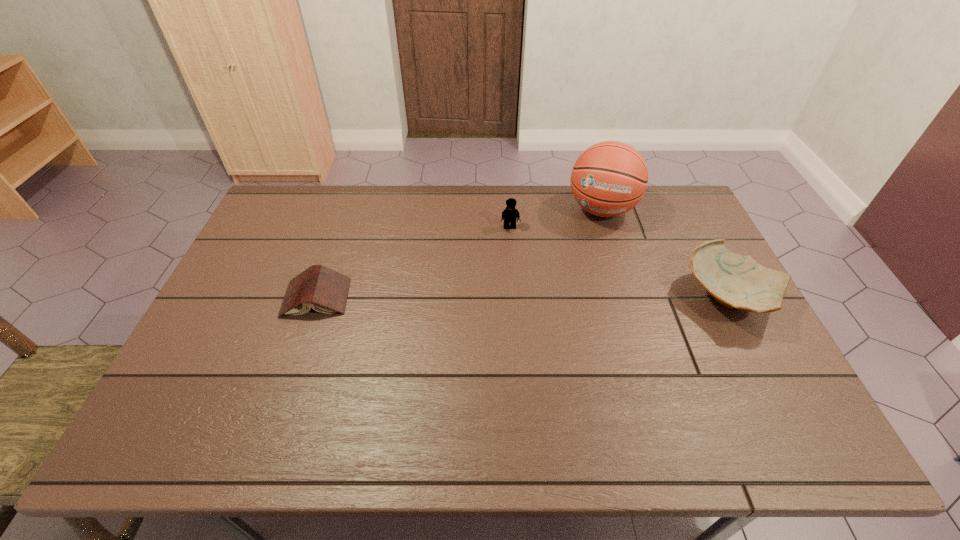
Where is `free spot between the pottery and the Lego`? This screenshot has height=540, width=960. free spot between the pottery and the Lego is located at coordinates (619, 262).

Locate an element on the screen. This screenshot has width=960, height=540. free area in between the book and the tallest object is located at coordinates (459, 253).

The width and height of the screenshot is (960, 540). In order to click on vacant space in between the pottery and the second object from left to right in this screenshot , I will do [619, 262].

Choose which object is the nearest neighbor to the third object from right to left. Please provide its 2D coordinates. Your answer should be formatted as a tuple, i.e. [(x, y)], where the tuple contains the x and y coordinates of a point satisfying the conditions above.

[(610, 178)]

Identify the location of object that can be found as the third closest to the rightmost object. This screenshot has height=540, width=960. (324, 290).

Find the location of a particular element. The height and width of the screenshot is (540, 960). free location that satisfies the following two spatial constraints: 1. on the front side of the second object from left to right; 2. on the right side of the pottery is located at coordinates tap(515, 297).